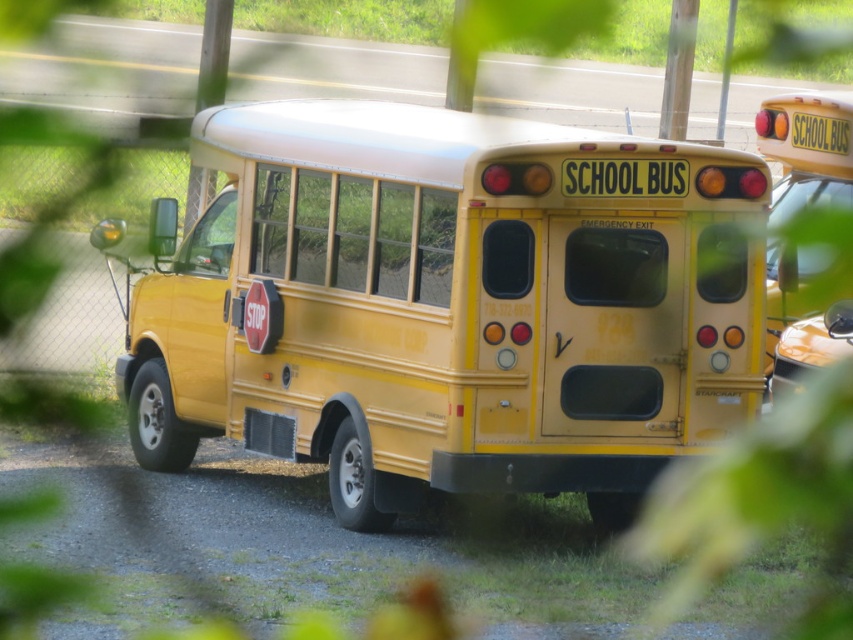
You are a delivery person trying to load a package onto the yellow matte school bus at center and the yellow matte school bus at right. Which bus has a higher loading height due to its height?

The yellow matte school bus at center is taller than the yellow matte school bus at right, so it has a higher loading height.